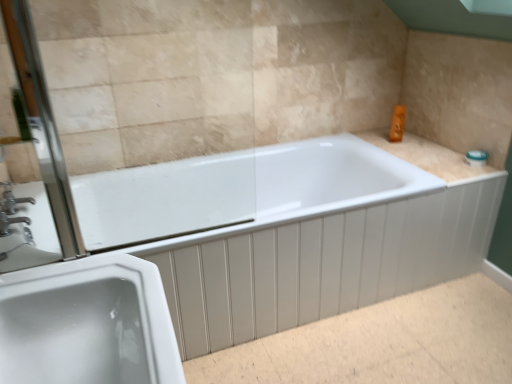
Question: From the image's perspective, is beige tile counter top at upper right on clear glass screen door at left?

Choices:
 (A) no
 (B) yes

Answer: (B)

Question: Is beige tile counter top at upper right to the right of clear glass screen door at left from the viewer's perspective?

Choices:
 (A) yes
 (B) no

Answer: (A)

Question: Is beige tile counter top at upper right closer to the viewer compared to clear glass screen door at left?

Choices:
 (A) no
 (B) yes

Answer: (A)

Question: From a real-world perspective, is beige tile counter top at upper right below clear glass screen door at left?

Choices:
 (A) yes
 (B) no

Answer: (A)

Question: Is beige tile counter top at upper right outside clear glass screen door at left?

Choices:
 (A) no
 (B) yes

Answer: (B)

Question: Could clear glass screen door at left be considered to be inside beige tile counter top at upper right?

Choices:
 (A) no
 (B) yes

Answer: (A)

Question: From the image's perspective, is white glossy bathtub at center below white glossy sink at lower left?

Choices:
 (A) no
 (B) yes

Answer: (A)

Question: Does white glossy bathtub at center have a lesser height compared to white glossy sink at lower left?

Choices:
 (A) no
 (B) yes

Answer: (A)

Question: From the image's perspective, does white glossy bathtub at center appear higher than white glossy sink at lower left?

Choices:
 (A) yes
 (B) no

Answer: (A)

Question: Is white glossy bathtub at center at the left side of white glossy sink at lower left?

Choices:
 (A) no
 (B) yes

Answer: (A)

Question: Does white glossy bathtub at center come in front of white glossy sink at lower left?

Choices:
 (A) yes
 (B) no

Answer: (B)

Question: Does white glossy bathtub at center touch white glossy sink at lower left?

Choices:
 (A) no
 (B) yes

Answer: (A)

Question: From the image's perspective, is silver metallic faucet at left above white glossy bathtub at center?

Choices:
 (A) yes
 (B) no

Answer: (A)